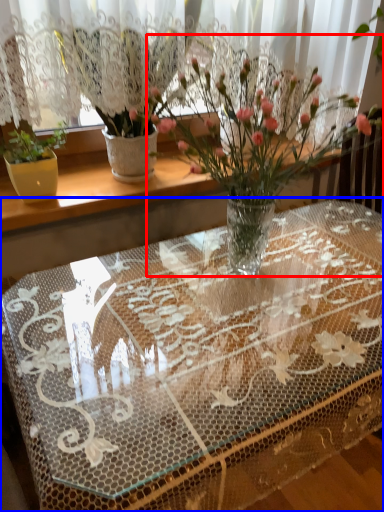
Question: Which object is closer to the camera taking this photo, houseplant (highlighted by a red box) or table (highlighted by a blue box)?

Choices:
 (A) houseplant
 (B) table

Answer: (B)